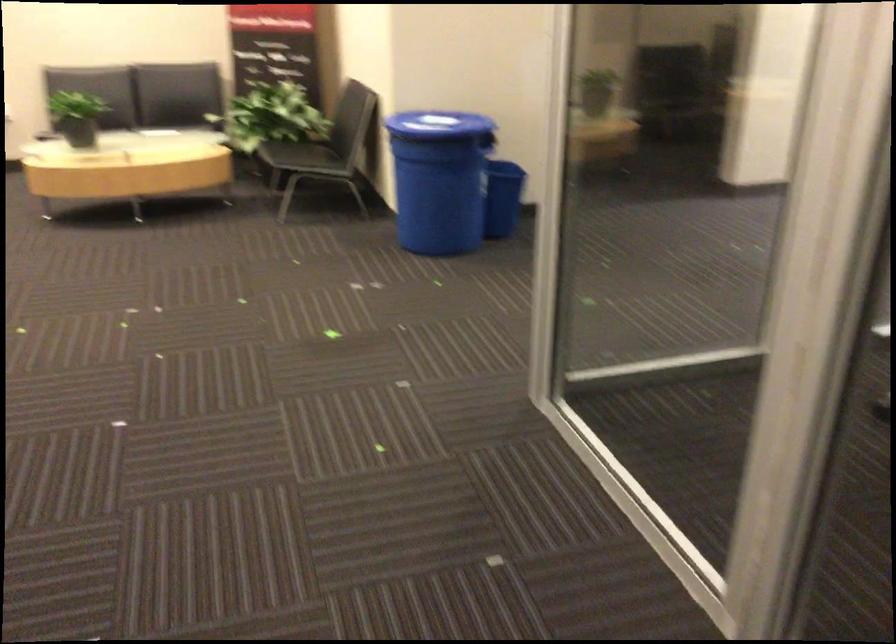
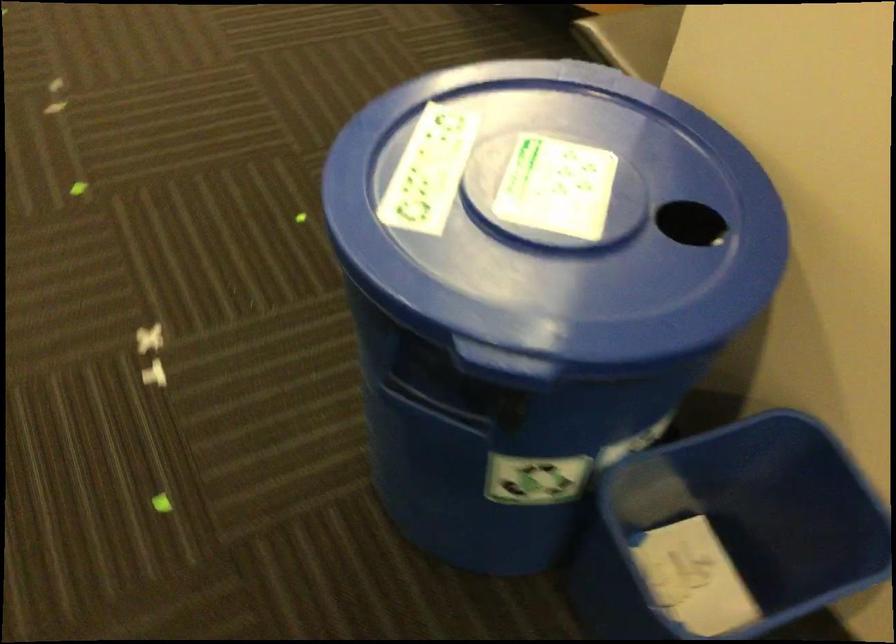
In the second image, find the point that corresponds to [435,109] in the first image.

(556, 187)